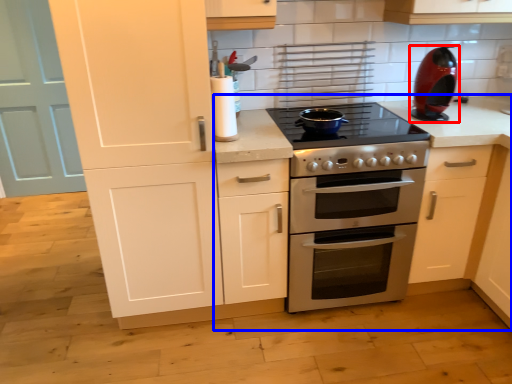
Question: Which point is further to the camera, kitchen appliance (highlighted by a red box) or countertop (highlighted by a blue box)?

Choices:
 (A) kitchen appliance
 (B) countertop

Answer: (A)